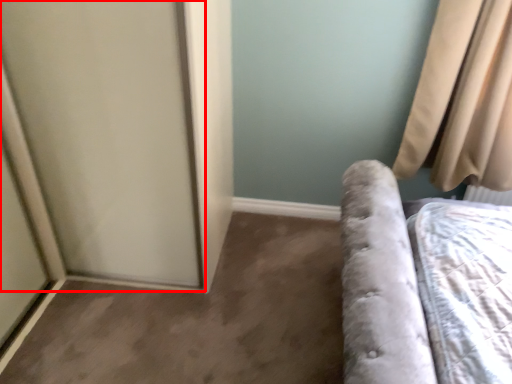
Question: From the image's perspective, where is screen door (annotated by the red box) located relative to curtain?

Choices:
 (A) above
 (B) below

Answer: (B)